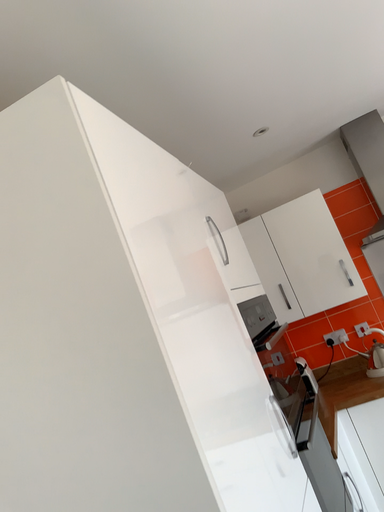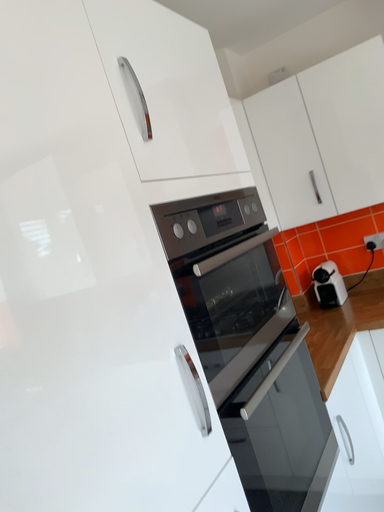
Question: Which way did the camera rotate in the video?

Choices:
 (A) rotated upward
 (B) rotated downward

Answer: (B)